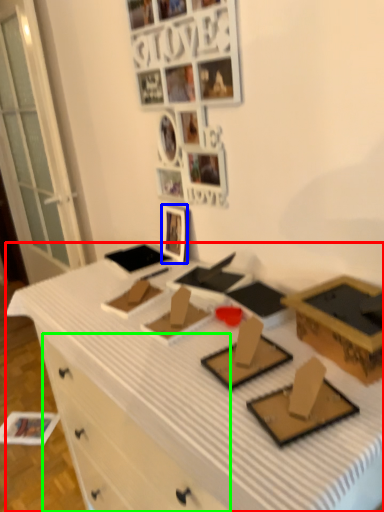
Question: Which object is positioned farthest from desk (highlighted by a red box)? Select from picture frame (highlighted by a blue box) and drawer (highlighted by a green box).

Choices:
 (A) picture frame
 (B) drawer

Answer: (A)